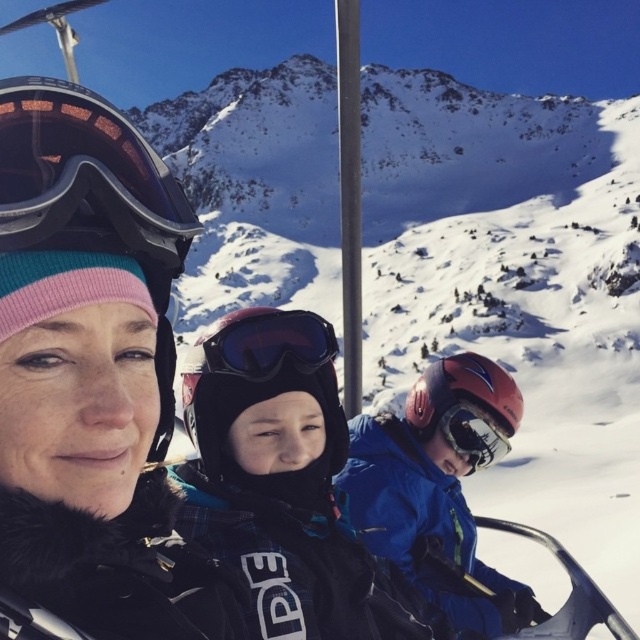
Question: Which of the following is the farthest from the observer?

Choices:
 (A) (170, 240)
 (B) (356, 561)
 (C) (296, 324)
 (D) (180, 612)

Answer: (C)

Question: Can you confirm if matte black helmet at center is wider than transparent blue lens goggles at center?

Choices:
 (A) no
 (B) yes

Answer: (B)

Question: Which point appears farthest from the camera in this image?

Choices:
 (A) (240, 376)
 (B) (468, 436)
 (C) (253, 515)
 (D) (138, 196)

Answer: (B)

Question: Is matte black helmet at center above matte black goggles at center?

Choices:
 (A) yes
 (B) no

Answer: (A)

Question: Which of these objects is positioned farthest from the matte black goggles at upper left?

Choices:
 (A) blue matte jacket at center
 (B) matte black goggles at center
 (C) black matte ski jacket at center
 (D) matte black helmet at center

Answer: (B)

Question: Can you confirm if transparent blue lens goggles at center is positioned below matte black goggles at center?

Choices:
 (A) yes
 (B) no

Answer: (B)